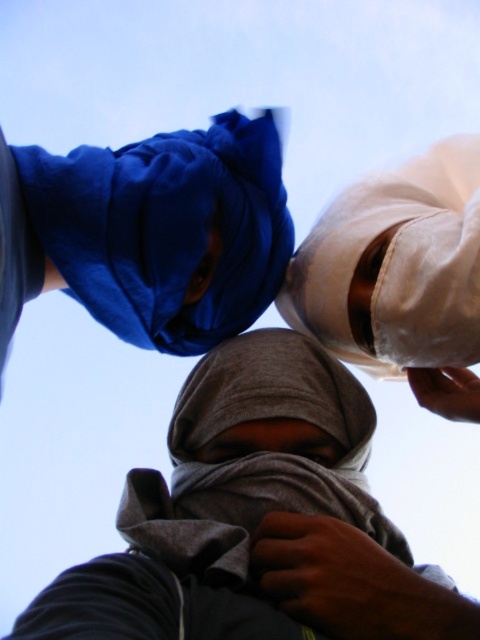
Question: Which of the following is the closest to the observer?

Choices:
 (A) blue fabric headscarf at upper center
 (B) gray fabric headscarf at center

Answer: (B)

Question: Is blue fabric headscarf at upper center smaller than gray fabric headscarf at center?

Choices:
 (A) no
 (B) yes

Answer: (B)

Question: Does blue fabric headscarf at upper center appear on the left side of gray fabric headscarf at center?

Choices:
 (A) yes
 (B) no

Answer: (A)

Question: Does blue fabric headscarf at upper center appear under gray fabric headscarf at center?

Choices:
 (A) no
 (B) yes

Answer: (A)